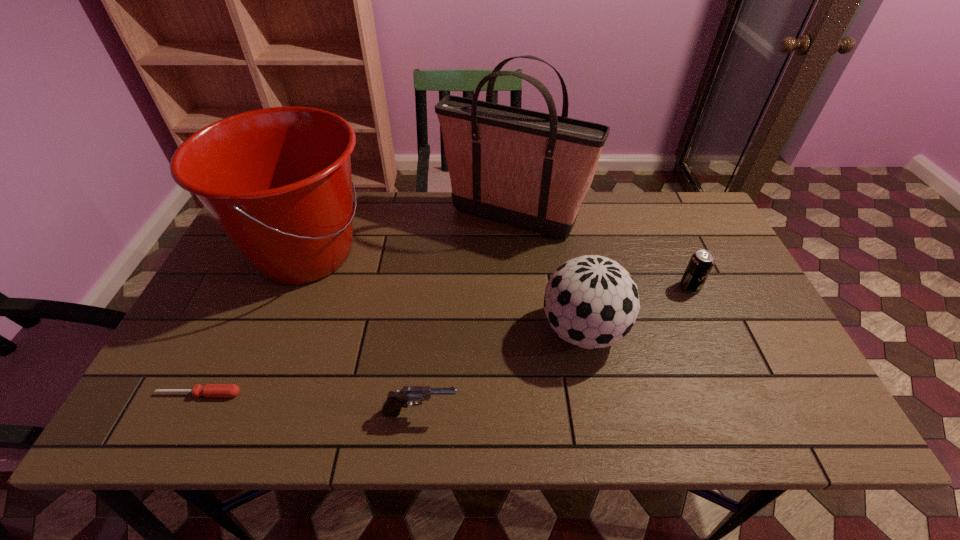
Identify the location of vacant region that satisfies the following two spatial constraints: 1. with the handle attached to the rim of the bucket; 2. on the left side of the soda can. The width and height of the screenshot is (960, 540). (294, 287).

Identify the location of free space in the image that satisfies the following two spatial constraints: 1. on the front side of the soccer ball; 2. on the left side of the tallest object. The height and width of the screenshot is (540, 960). (522, 330).

Locate an element on the screen. free space that satisfies the following two spatial constraints: 1. on the back side of the rightmost object; 2. with the handle attached to the rim of the second tallest object is located at coordinates (675, 254).

Identify the location of free space in the image that satisfies the following two spatial constraints: 1. with the handle attached to the rim of the bucket; 2. on the front side of the fifth farthest object. (251, 394).

This screenshot has height=540, width=960. Find the location of `vacant area in the image that satisfies the following two spatial constraints: 1. with the handle attached to the rim of the bucket; 2. on the back side of the soccer ball`. vacant area in the image that satisfies the following two spatial constraints: 1. with the handle attached to the rim of the bucket; 2. on the back side of the soccer ball is located at coordinates (276, 330).

This screenshot has height=540, width=960. Identify the location of free space in the image that satisfies the following two spatial constraints: 1. with the handle attached to the rim of the fourth shortest object; 2. on the left side of the second tallest object. (276, 330).